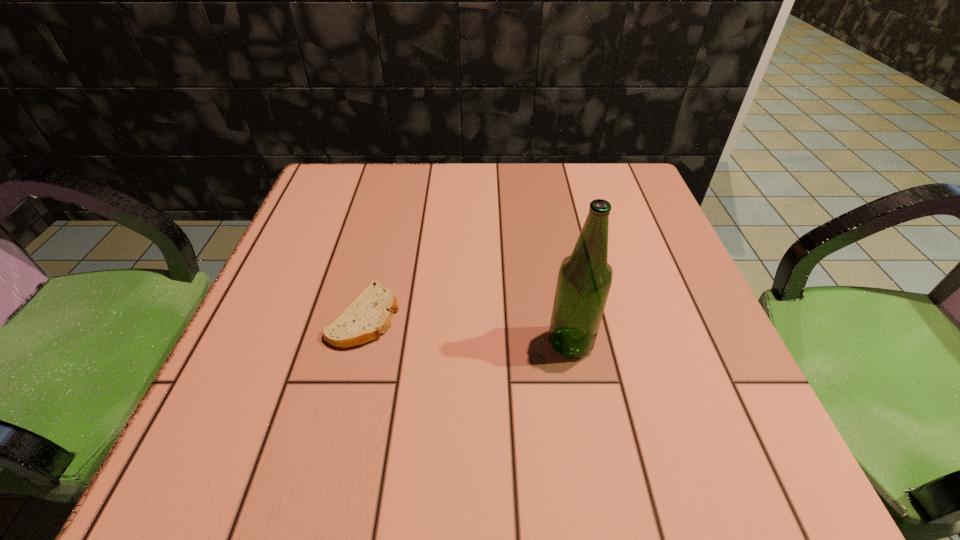
In the image, there is a desktop. Where is `vacant space at the near edge`? vacant space at the near edge is located at coordinates (421, 443).

Where is `vacant point at the left edge`? The height and width of the screenshot is (540, 960). vacant point at the left edge is located at coordinates (303, 273).

Identify the location of vacant space at the right edge of the desktop. (677, 403).

You are a GUI agent. You are given a task and a screenshot of the screen. Output one action in this format:
    pyautogui.click(x=<x>, y=<y>)
    Task: Click on the vacant region at the far right corner of the desktop
    
    Given the screenshot: What is the action you would take?
    pyautogui.click(x=660, y=220)

I want to click on vacant space at the near right corner of the desktop, so click(x=754, y=478).